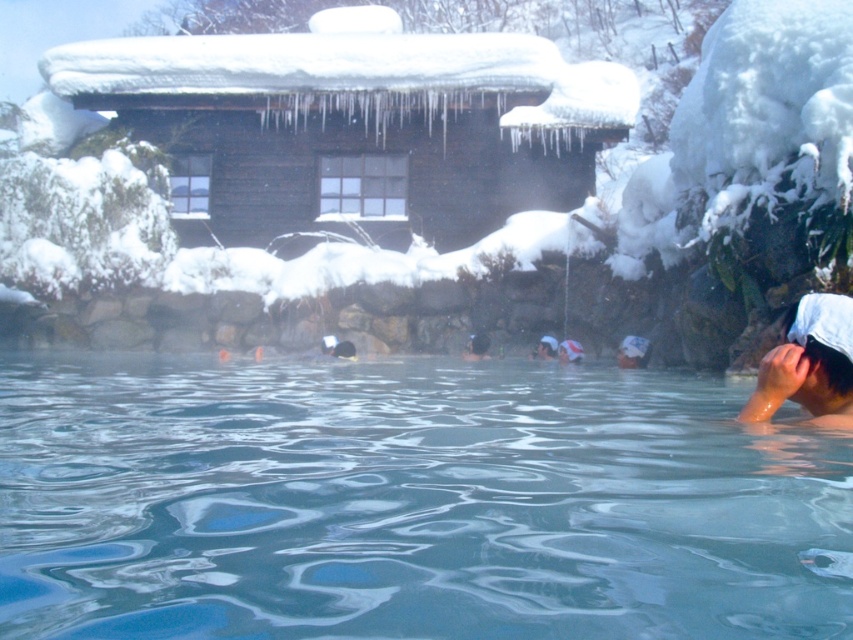
Question: From the image, what is the correct spatial relationship of clear water at center in relation to white cloth headband at lower right?

Choices:
 (A) above
 (B) below

Answer: (B)

Question: Is clear water at center smaller than white cloth headband at lower right?

Choices:
 (A) yes
 (B) no

Answer: (B)

Question: Does clear water at center have a lesser width compared to white cloth headband at lower right?

Choices:
 (A) yes
 (B) no

Answer: (B)